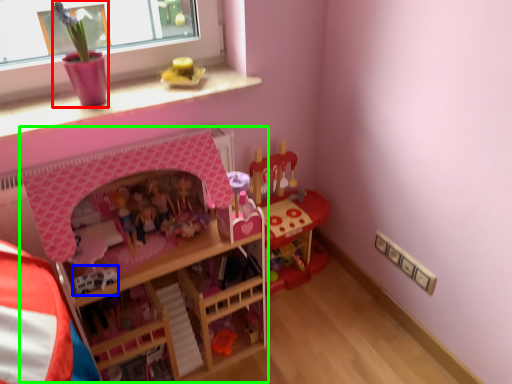
Question: Considering the real-world distances, which object is closest to toy (highlighted by a red box)? toy (highlighted by a blue box) or bunk bed (highlighted by a green box).

Choices:
 (A) toy
 (B) bunk bed

Answer: (B)